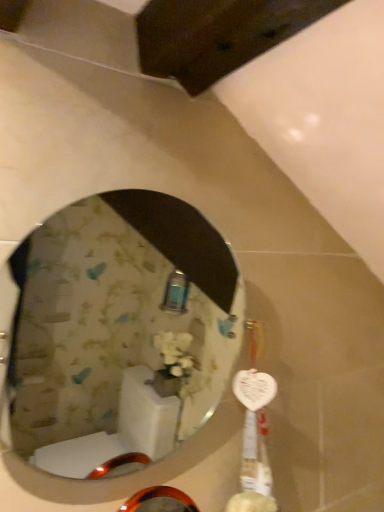
In order to click on polished chrome mirror at center in this screenshot , I will do `click(118, 332)`.

Describe the element at coordinates (118, 332) in the screenshot. The width and height of the screenshot is (384, 512). I see `polished chrome mirror at center` at that location.

This screenshot has height=512, width=384. Find the location of `polished chrome mirror at center`. polished chrome mirror at center is located at coordinates (118, 332).